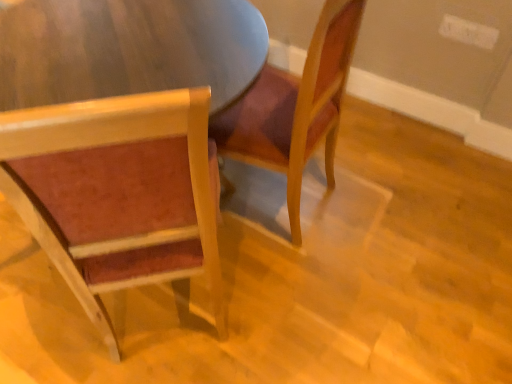
This screenshot has height=384, width=512. What do you see at coordinates (118, 193) in the screenshot?
I see `matte wood chair at left, acting as the 2th chair starting from the right` at bounding box center [118, 193].

Locate an element on the screen. This screenshot has height=384, width=512. matte wood chair at left, acting as the 2th chair starting from the right is located at coordinates pyautogui.click(x=118, y=193).

This screenshot has width=512, height=384. Identify the location of velvet-like red chair at center, the 2th chair positioned from the left. (295, 107).

Image resolution: width=512 pixels, height=384 pixels. Describe the element at coordinates (295, 107) in the screenshot. I see `velvet-like red chair at center, the 2th chair positioned from the left` at that location.

The height and width of the screenshot is (384, 512). Identify the location of matte wood chair at left, acting as the 1th chair starting from the left. (118, 193).

Which is more to the right, matte wood chair at left, acting as the 1th chair starting from the left, or velvet-like red chair at center, the 2th chair positioned from the left?

velvet-like red chair at center, the 2th chair positioned from the left, is more to the right.

Considering the relative positions of matte wood chair at left, acting as the 2th chair starting from the right, and velvet-like red chair at center, the first chair positioned from the right, in the image provided, is matte wood chair at left, acting as the 2th chair starting from the right, in front of velvet-like red chair at center, the first chair positioned from the right,?

Yes, matte wood chair at left, acting as the 2th chair starting from the right, is closer to the viewer.

Which is closer to the camera, (127, 224) or (225, 142)?

The point (127, 224) is in front.

From the image's perspective, is matte wood chair at left, acting as the 1th chair starting from the left, above or below velvet-like red chair at center, the 2th chair positioned from the left?

From the image's perspective, matte wood chair at left, acting as the 1th chair starting from the left, appears below velvet-like red chair at center, the 2th chair positioned from the left.

From a real-world perspective, which is physically below, matte wood chair at left, acting as the 1th chair starting from the left, or velvet-like red chair at center, the 2th chair positioned from the left?

velvet-like red chair at center, the 2th chair positioned from the left, from a real-world perspective.

Considering the sizes of objects matte wood chair at left, acting as the 2th chair starting from the right, and velvet-like red chair at center, the 2th chair positioned from the left, in the image provided, who is wider, matte wood chair at left, acting as the 2th chair starting from the right, or velvet-like red chair at center, the 2th chair positioned from the left,?

matte wood chair at left, acting as the 2th chair starting from the right, is wider.

Between matte wood chair at left, acting as the 2th chair starting from the right, and velvet-like red chair at center, the first chair positioned from the right, which one has more height?

With more height is matte wood chair at left, acting as the 2th chair starting from the right.

Can you confirm if matte wood chair at left, acting as the 1th chair starting from the left, is smaller than velvet-like red chair at center, the first chair positioned from the right?

No, matte wood chair at left, acting as the 1th chair starting from the left, is not smaller than velvet-like red chair at center, the first chair positioned from the right.

Do you think matte wood chair at left, acting as the 1th chair starting from the left, is within velvet-like red chair at center, the 2th chair positioned from the left, or outside of it?

matte wood chair at left, acting as the 1th chair starting from the left, is located beyond the bounds of velvet-like red chair at center, the 2th chair positioned from the left.

Is there a large distance between matte wood chair at left, acting as the 2th chair starting from the right, and velvet-like red chair at center, the first chair positioned from the right?

That's not correct — matte wood chair at left, acting as the 2th chair starting from the right, is a little close to velvet-like red chair at center, the first chair positioned from the right.

Is velvet-like red chair at center, the first chair positioned from the right, at the back of matte wood chair at left, acting as the 1th chair starting from the left?

No.

Based on the photo, how different are the orientations of matte wood chair at left, acting as the 2th chair starting from the right, and velvet-like red chair at center, the first chair positioned from the right, in degrees?

The facing directions of matte wood chair at left, acting as the 2th chair starting from the right, and velvet-like red chair at center, the first chair positioned from the right, are 46.4 degrees apart.

Image resolution: width=512 pixels, height=384 pixels. What are the coordinates of `chair above the matte wood chair at left, acting as the 2th chair starting from the right (from the image's perspective)` in the screenshot? It's located at (295, 107).

Considering the relative positions of velvet-like red chair at center, the first chair positioned from the right, and matte wood chair at left, acting as the 2th chair starting from the right, in the image provided, is velvet-like red chair at center, the first chair positioned from the right, to the left or to the right of matte wood chair at left, acting as the 2th chair starting from the right,?

velvet-like red chair at center, the first chair positioned from the right, is positioned on matte wood chair at left, acting as the 2th chair starting from the right,'s right side.

Is the position of velvet-like red chair at center, the first chair positioned from the right, more distant than that of matte wood chair at left, acting as the 2th chair starting from the right?

That is True.

Which is behind, point (350, 18) or point (15, 135)?

The point (350, 18) is farther.

From the image's perspective, is velvet-like red chair at center, the first chair positioned from the right, on matte wood chair at left, acting as the 1th chair starting from the left?

Yes, from the image's perspective, velvet-like red chair at center, the first chair positioned from the right, is above matte wood chair at left, acting as the 1th chair starting from the left.

From a real-world perspective, is velvet-like red chair at center, the first chair positioned from the right, over matte wood chair at left, acting as the 2th chair starting from the right?

No, from a real-world perspective, velvet-like red chair at center, the first chair positioned from the right, is not above matte wood chair at left, acting as the 2th chair starting from the right.

Which of these two, velvet-like red chair at center, the first chair positioned from the right, or matte wood chair at left, acting as the 2th chair starting from the right, is thinner?

velvet-like red chair at center, the first chair positioned from the right, is thinner.

Can you confirm if velvet-like red chair at center, the first chair positioned from the right, is taller than matte wood chair at left, acting as the 2th chair starting from the right?

No.

Between velvet-like red chair at center, the first chair positioned from the right, and matte wood chair at left, acting as the 1th chair starting from the left, which one has smaller size?

With smaller size is velvet-like red chair at center, the first chair positioned from the right.

Is velvet-like red chair at center, the first chair positioned from the right, situated inside matte wood chair at left, acting as the 1th chair starting from the left, or outside?

velvet-like red chair at center, the first chair positioned from the right, is located beyond the bounds of matte wood chair at left, acting as the 1th chair starting from the left.

Are velvet-like red chair at center, the first chair positioned from the right, and matte wood chair at left, acting as the 1th chair starting from the left, located far from each other?

velvet-like red chair at center, the first chair positioned from the right, is near matte wood chair at left, acting as the 1th chair starting from the left, not far away.

Is velvet-like red chair at center, the 2th chair positioned from the left, aimed at matte wood chair at left, acting as the 1th chair starting from the left?

No.

How many degrees apart are the facing directions of velvet-like red chair at center, the first chair positioned from the right, and matte wood chair at left, acting as the 2th chair starting from the right?

They differ by 46.4 degrees in their facing directions.

How much distance is there between velvet-like red chair at center, the first chair positioned from the right, and matte wood chair at left, acting as the 1th chair starting from the left?

velvet-like red chair at center, the first chair positioned from the right, and matte wood chair at left, acting as the 1th chair starting from the left, are 20.27 inches apart.

Where is `chair lying on the left of velvet-like red chair at center, the 2th chair positioned from the left`? This screenshot has height=384, width=512. chair lying on the left of velvet-like red chair at center, the 2th chair positioned from the left is located at coordinates (118, 193).

Image resolution: width=512 pixels, height=384 pixels. What are the coordinates of `chair that is behind the matte wood chair at left, acting as the 2th chair starting from the right` in the screenshot? It's located at (295, 107).

The height and width of the screenshot is (384, 512). Find the location of `chair that appears above the velvet-like red chair at center, the 2th chair positioned from the left (from a real-world perspective)`. chair that appears above the velvet-like red chair at center, the 2th chair positioned from the left (from a real-world perspective) is located at coordinates (118, 193).